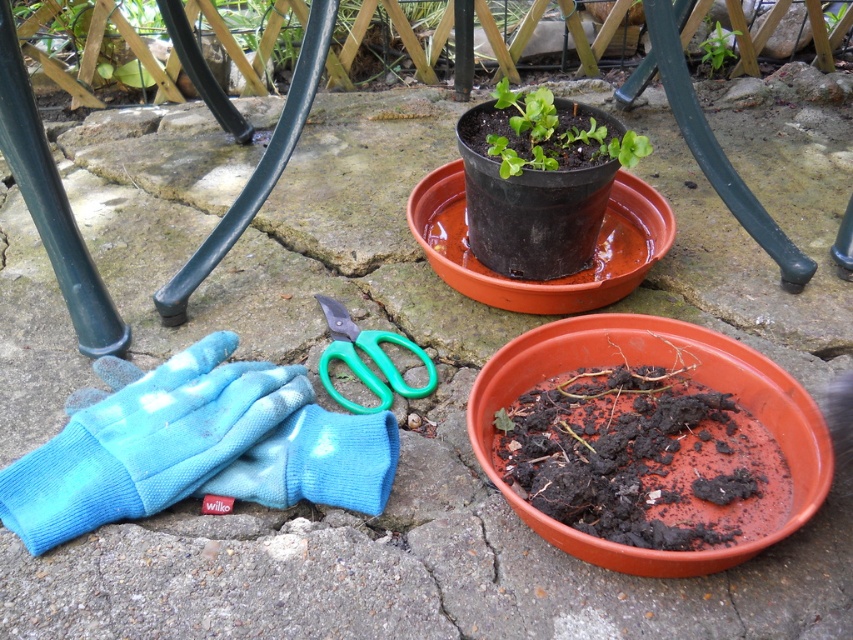
Question: Among these points, which one is farthest from the camera?

Choices:
 (A) (283, 416)
 (B) (355, 332)
 (C) (766, 438)
 (D) (701, 56)

Answer: (D)

Question: Does green plastic scissors at center appear over green leafy plant at upper center?

Choices:
 (A) yes
 (B) no

Answer: (B)

Question: Which of the following is the closest to the observer?

Choices:
 (A) dark brown soil at center
 (B) green matte plant at upper center

Answer: (A)

Question: Which object appears closest to the camera in this image?

Choices:
 (A) green plastic scissors at center
 (B) blue fabric glove at lower left

Answer: (B)

Question: Observing the image, what is the correct spatial positioning of blue fabric glove at lower left in reference to green leafy plant at upper center?

Choices:
 (A) below
 (B) above

Answer: (A)

Question: Is dark brown soil at center thinner than blue fabric glove at lower left?

Choices:
 (A) yes
 (B) no

Answer: (B)